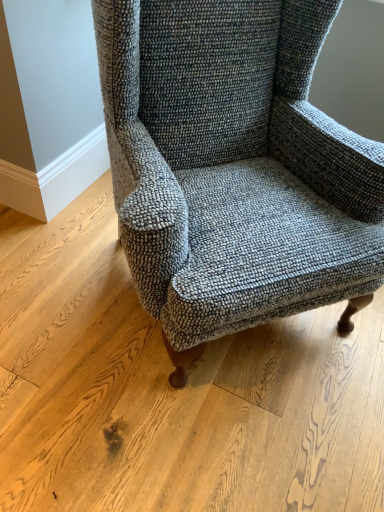
The image size is (384, 512). What are the coordinates of `textured gray fabric chair at center` in the screenshot? It's located at (233, 166).

Measure the distance between point (x=382, y=175) and camera.

Point (x=382, y=175) and camera are 1.14 meters apart.

This screenshot has width=384, height=512. Describe the element at coordinates (233, 166) in the screenshot. I see `textured gray fabric chair at center` at that location.

Identify the location of textured gray fabric chair at center. This screenshot has width=384, height=512. (233, 166).